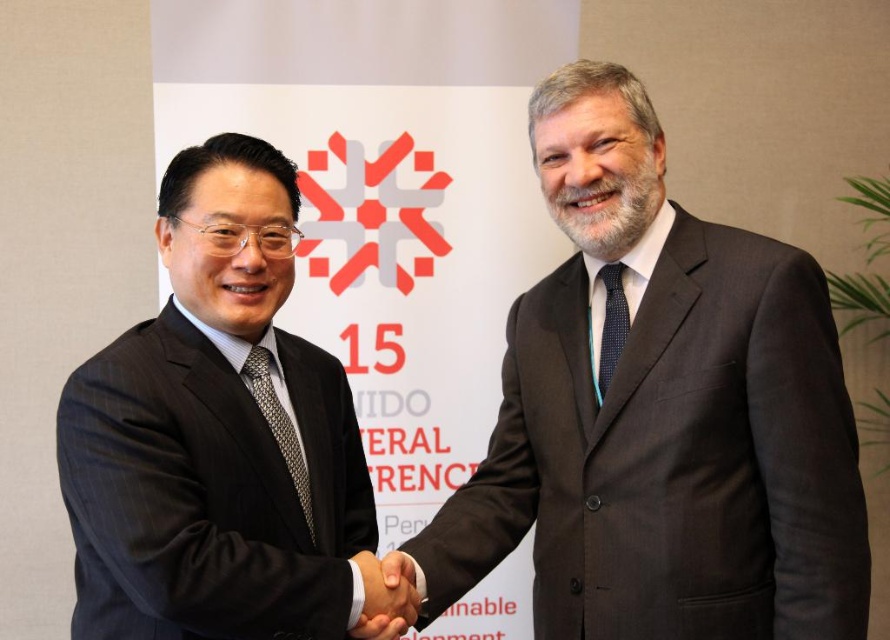
Question: Is black suit at left behind silver metallic tie at center?

Choices:
 (A) yes
 (B) no

Answer: (B)

Question: Where is black glossy hand at center located in relation to silver metallic tie at center in the image?

Choices:
 (A) above
 (B) below

Answer: (B)

Question: Which point is farther to the camera?

Choices:
 (A) silver metallic tie at center
 (B) polka dot silk tie at center
 (C) black suit at left

Answer: (B)

Question: Based on their relative distances, which object is nearer to the black glossy hand at center?

Choices:
 (A) black suit at left
 (B) silver metallic tie at center

Answer: (B)

Question: Does black suit at left come behind silver metallic tie at center?

Choices:
 (A) yes
 (B) no

Answer: (B)

Question: Which of the following is the closest to the observer?

Choices:
 (A) polka dot silk tie at center
 (B) silver metallic tie at center
 (C) dark gray suit at center

Answer: (C)